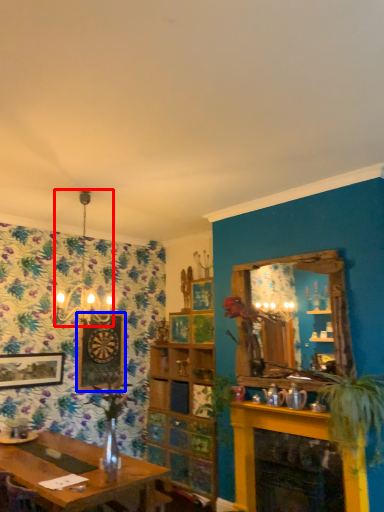
Question: Which object appears farthest to the camera in this image, light fixture (highlighted by a red box) or picture frame (highlighted by a blue box)?

Choices:
 (A) light fixture
 (B) picture frame

Answer: (B)